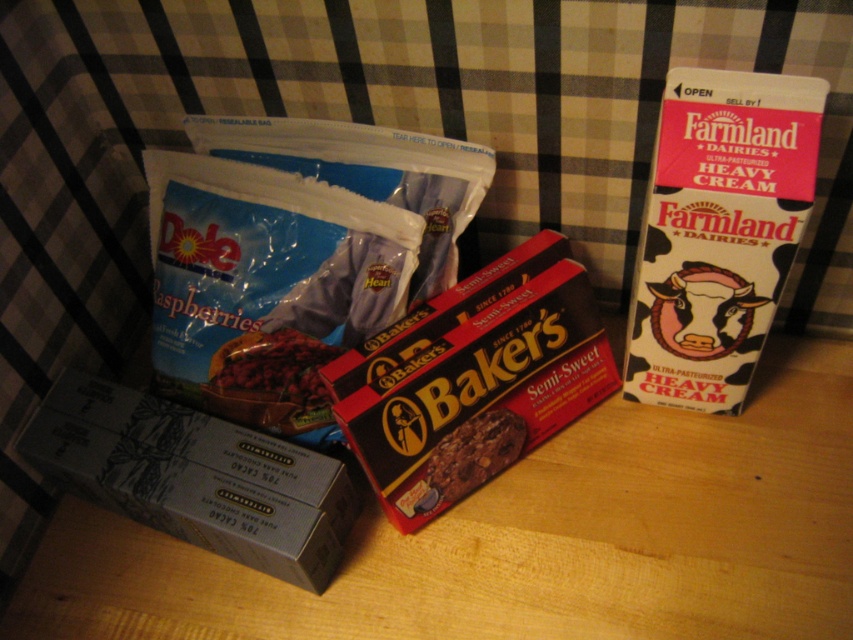
You are arranging items on a wooden table with a checkered backdrop. You have a matte gray box of chocolate at lower left and a Farmland Dairy Heavy Cream carton on the right. Which item is positioned closer to the bottom edge of the table?

The matte gray box of chocolate at lower left is closer to the bottom edge of the table because its y coordinate is 0.230, which is lower than the carton on the right.